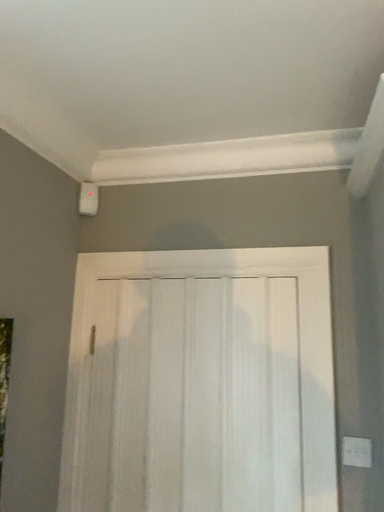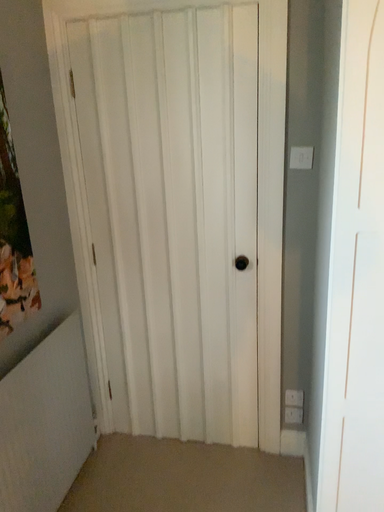
Question: How did the camera likely rotate when shooting the video?

Choices:
 (A) rotated upward
 (B) rotated downward

Answer: (B)